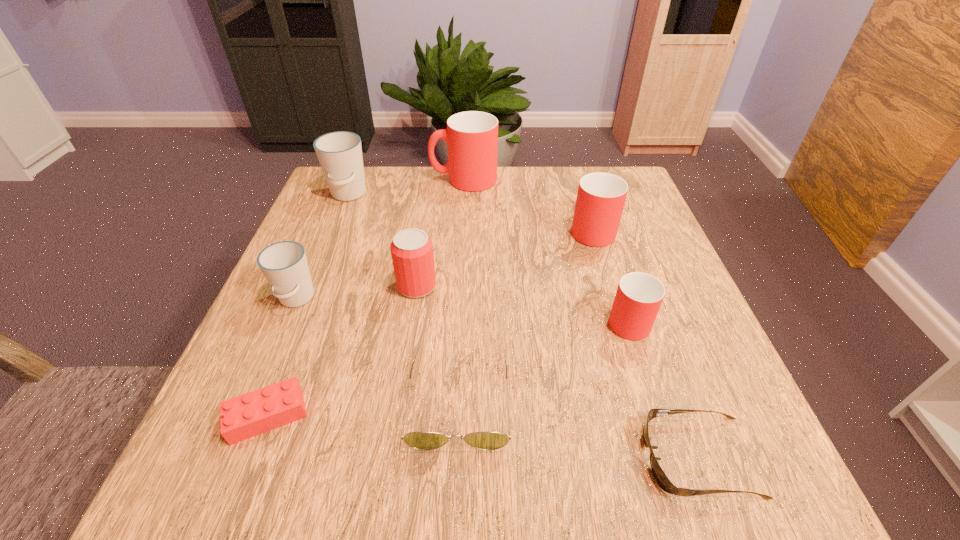
I want to click on the farthest red cup, so click(472, 137).

Identify the location of the leftmost red cup. (472, 137).

Find the location of a particular element. The width and height of the screenshot is (960, 540). the bigger white cup is located at coordinates (339, 153).

What are the coordinates of `the third farthest object` in the screenshot? It's located at (600, 200).

What are the coordinates of `the third nearest cup` in the screenshot? It's located at (600, 200).

Image resolution: width=960 pixels, height=540 pixels. Identify the location of red beer can. (411, 249).

Image resolution: width=960 pixels, height=540 pixels. Find the location of `the nearer white cup`. the nearer white cup is located at coordinates (284, 264).

Find the location of a particular element. the smallest red cup is located at coordinates (639, 296).

This screenshot has height=540, width=960. Identify the location of the left sunglasses. (425, 441).

You are a GUI agent. You are given a task and a screenshot of the screen. Output one action in this format:
    pyautogui.click(x=<x>, y=<y>)
    Task: Click on the seventh tallest object
    Image resolution: width=960 pixels, height=540 pixels.
    Given the screenshot: What is the action you would take?
    pyautogui.click(x=425, y=441)